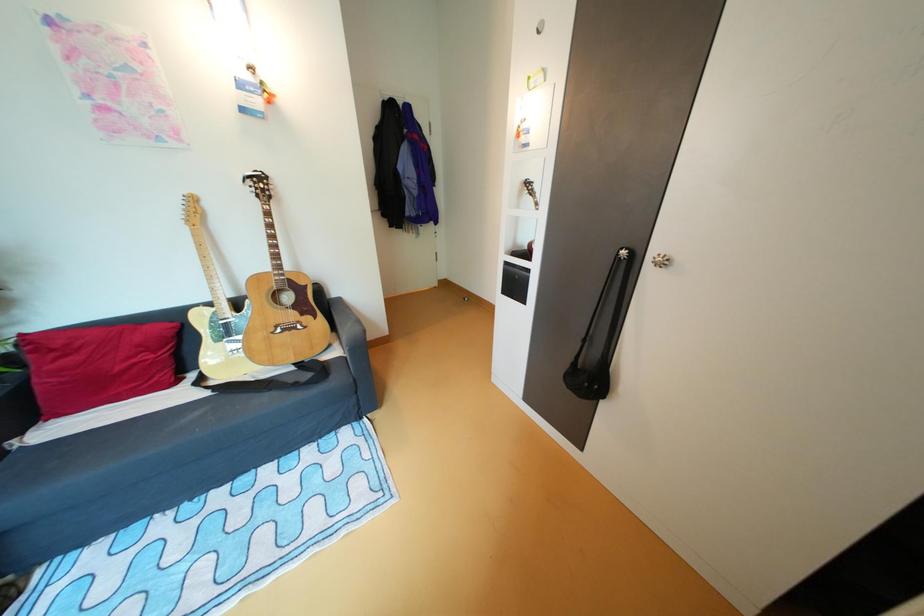
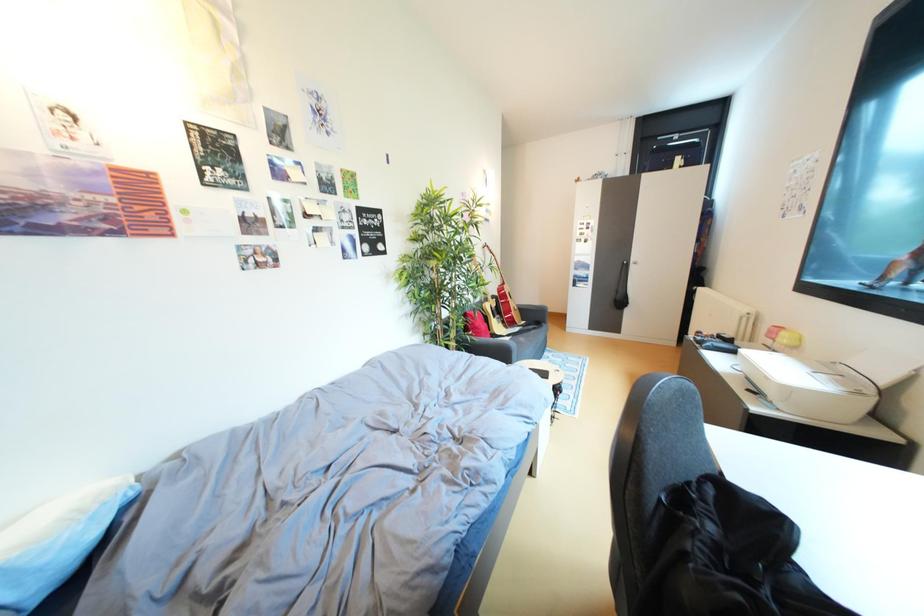
The images are taken continuously from a first-person perspective. In which direction are you moving?

The cameraman moved toward left, backward.